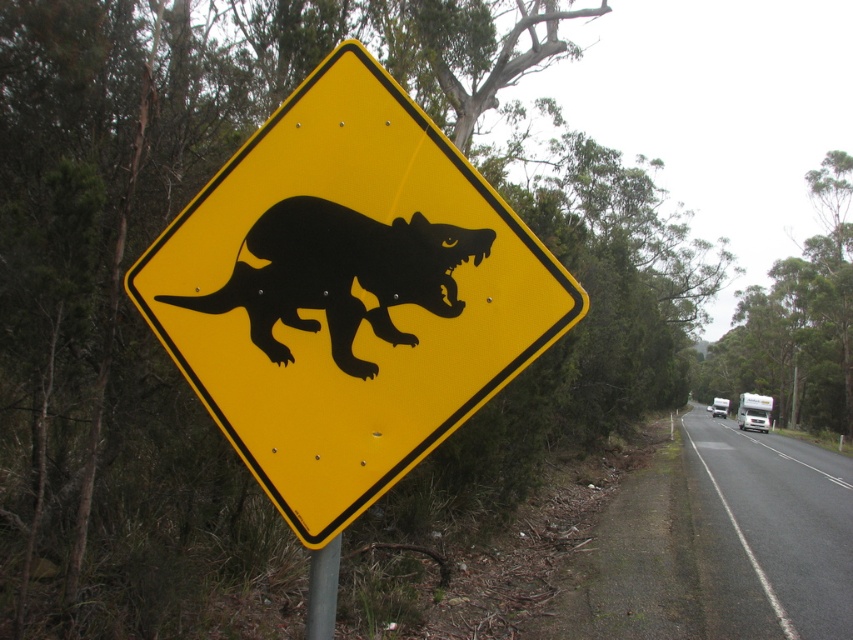
You are standing at the point marked by the coordinates point (445, 173). You want to cross the road to reach the metal pole with the yellow road sign. The road is 2 lanes wide. If the distance from your current position to the metal pole is 10 feet, can you safely cross the road without needing to walk more than 5.40 feet from your original position?

The point (445, 173) and viewer are 5.40 feet apart from each other. Since the distance to the metal pole is 10 feet, you would need to walk further than 5.40 feet to reach it, so you cannot safely cross without exceeding the 5.40 feet limit.

You are driving a car that is 1.5 meters wide and want to avoid hitting the black glossy ferret at center on the road. Can your car pass safely without hitting the ferret if you stay in your current lane?

The black glossy ferret at center is 1.58 meters away from the camera. Since your car is 1.5 meters wide and the ferret is positioned at the center of the road, there is enough space on either side of the ferret to maneuver around it while staying in your lane. However, the exact feasibility depends on the car speed and the ferret movement, but based on distance alone, it might be possible.

You are standing at point A with coordinates point A at [361,275]. You want to walk to point B which is 5.49 feet away from point A. Can you reach point B without crossing the road?

The points are 5.49 feet apart, so yes, you can reach point B without crossing the road since the distance is within a safe walking range on the same side of the road.